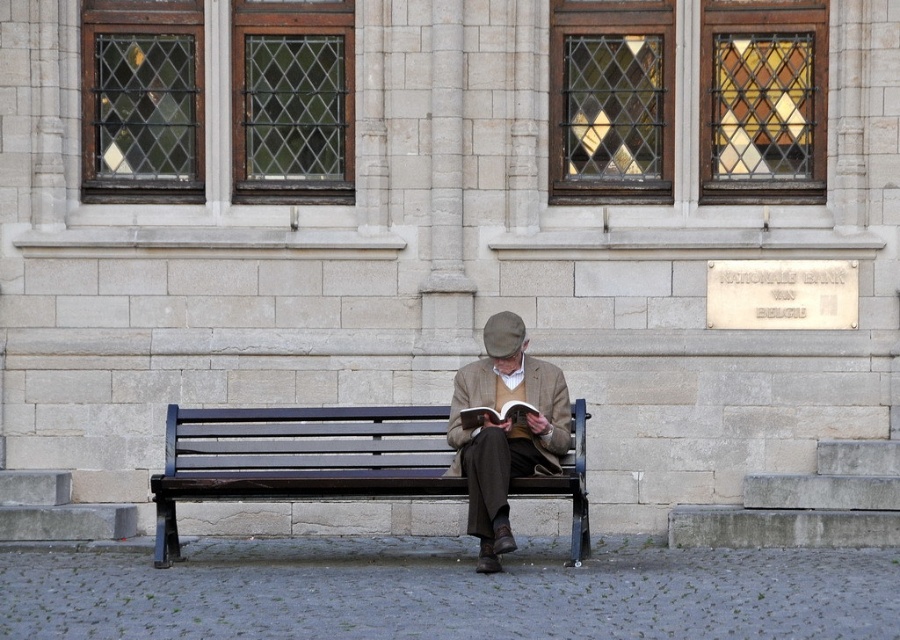
Who is positioned more to the right, silver metallic plaque at center right or hardcover book at center?

From the viewer's perspective, silver metallic plaque at center right appears more on the right side.

Can you confirm if silver metallic plaque at center right is wider than hardcover book at center?

Correct, the width of silver metallic plaque at center right exceeds that of hardcover book at center.

Image resolution: width=900 pixels, height=640 pixels. What do you see at coordinates (781, 294) in the screenshot?
I see `silver metallic plaque at center right` at bounding box center [781, 294].

At what (x,y) coordinates should I click in order to perform the action: click on silver metallic plaque at center right. Please return your answer as a coordinate pair (x, y). The image size is (900, 640). Looking at the image, I should click on (781, 294).

Is dark brown wood bench at center behind hardcover book at center?

Yes, dark brown wood bench at center is further from the viewer.

Is point (199, 438) positioned before point (483, 410)?

No, it is not.

In order to click on dark brown wood bench at center in this screenshot , I will do `click(298, 458)`.

Is matte brown jacket at center thinner than silver metallic plaque at center right?

Correct, matte brown jacket at center's width is less than silver metallic plaque at center right's.

Does point (493, 499) lie in front of point (853, 269)?

Yes, it is.

Between point (473, 496) and point (807, 323), which one is positioned behind?

The point (807, 323) is more distant.

The image size is (900, 640). In order to click on matte brown jacket at center in this screenshot , I will do `click(504, 429)`.